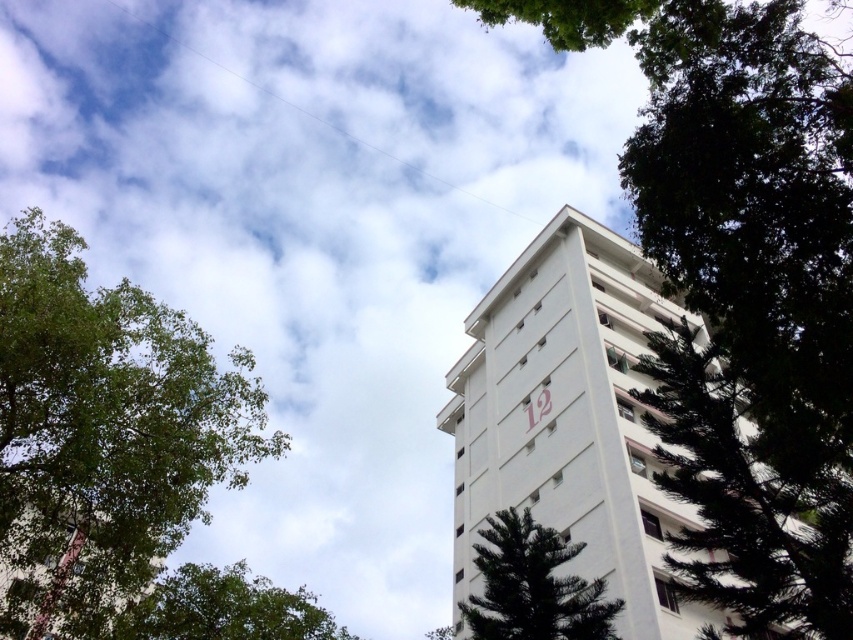
Who is higher up, green leafy tree at upper right or white smooth building at center?

Positioned higher is green leafy tree at upper right.

Is point (759, 380) closer to camera compared to point (635, 291)?

Yes, it is in front of point (635, 291).

Image resolution: width=853 pixels, height=640 pixels. Find the location of `green leafy tree at upper right`. green leafy tree at upper right is located at coordinates (743, 284).

Does white smooth building at center come behind green leafy tree at lower left?

No, it is not.

Does point (556, 326) come in front of point (299, 630)?

No, it is not.

You are a GUI agent. You are given a task and a screenshot of the screen. Output one action in this format:
    pyautogui.click(x=<x>, y=<y>)
    Task: Click on the white smooth building at center
    The image size is (853, 640).
    Given the screenshot: What is the action you would take?
    pyautogui.click(x=569, y=420)

Can you confirm if green leafy tree at left is positioned below green textured tree at center?

No.

At what (x,y) coordinates should I click in order to perform the action: click on green leafy tree at left. Please return your answer as a coordinate pair (x, y). This screenshot has height=640, width=853. Looking at the image, I should click on (103, 433).